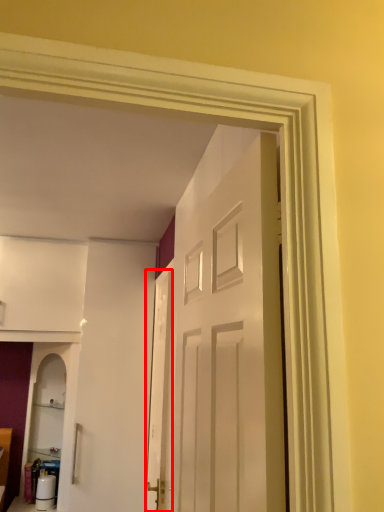
Question: From the image, what is the correct spatial relationship of screen door (annotated by the red box) in relation to door?

Choices:
 (A) left
 (B) right

Answer: (A)